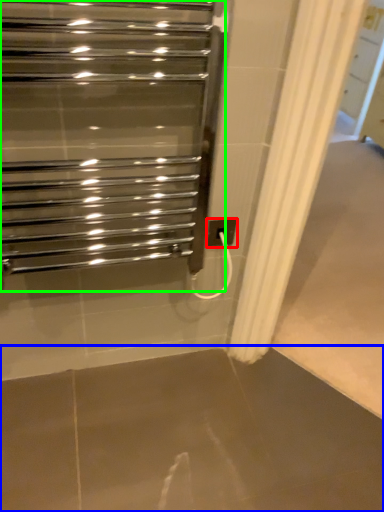
Question: Considering the real-world distances, which object is closest to electric outlet (highlighted by a red box)? concrete (highlighted by a blue box) or home appliance (highlighted by a green box).

Choices:
 (A) concrete
 (B) home appliance

Answer: (B)